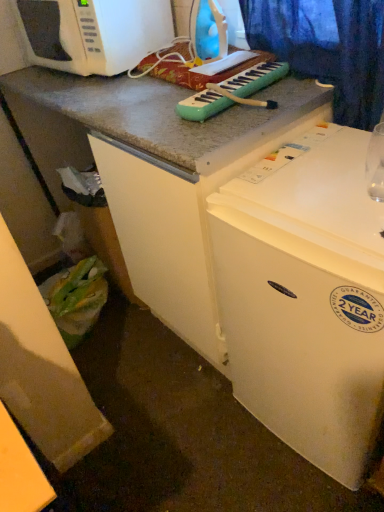
You are a GUI agent. You are given a task and a screenshot of the screen. Output one action in this format:
    pyautogui.click(x=<x>, y=<y>)
    Task: Click on the white matte refrigerator at upper right
    The height and width of the screenshot is (512, 384).
    Given the screenshot: What is the action you would take?
    pyautogui.click(x=306, y=297)

In order to face smooth white countertop at lower left, should I rotate leftwards or rightwards?

Rotate your view left by about 22.094°.

Where is `transparent glass at upper right`? The image size is (384, 512). transparent glass at upper right is located at coordinates [x=375, y=164].

Describe the element at coordinates (233, 92) in the screenshot. I see `teal plastic musical keyboard at center` at that location.

This screenshot has width=384, height=512. I want to click on teal plastic musical keyboard at center, so click(x=233, y=92).

Where is `white matte refrigerator at upper right`? white matte refrigerator at upper right is located at coordinates (306, 297).

Consider the image. Is white matte microwave oven at upper left facing towards teal plastic musical keyboard at center?

No, white matte microwave oven at upper left is not facing towards teal plastic musical keyboard at center.

Based on the photo, which object is more forward, white matte microwave oven at upper left or teal plastic musical keyboard at center?

teal plastic musical keyboard at center is in front.

From the image's perspective, is white matte microwave oven at upper left positioned above or below teal plastic musical keyboard at center?

white matte microwave oven at upper left is situated higher than teal plastic musical keyboard at center in the image.

From a real-world perspective, between white matte microwave oven at upper left and teal plastic musical keyboard at center, who is vertically higher?

In real-world perspective, white matte microwave oven at upper left is above.

Considering the positions of objects transparent glass at upper right and white matte microwave oven at upper left in the image provided, who is behind, transparent glass at upper right or white matte microwave oven at upper left?

white matte microwave oven at upper left is more distant.

From the image's perspective, is transparent glass at upper right positioned above or below white matte microwave oven at upper left?

Clearly, from the image's perspective, transparent glass at upper right is below white matte microwave oven at upper left.

From the picture: What's the angular difference between transparent glass at upper right and white matte microwave oven at upper left's facing directions?

The facing directions of transparent glass at upper right and white matte microwave oven at upper left are 17.1 degrees apart.

Considering the sizes of objects transparent glass at upper right and white matte microwave oven at upper left in the image provided, who is shorter, transparent glass at upper right or white matte microwave oven at upper left?

With less height is transparent glass at upper right.

From the image's perspective, is smooth white countertop at lower left located above or below teal plastic musical keyboard at center?

From the image's perspective, smooth white countertop at lower left appears below teal plastic musical keyboard at center.

Can you tell me how much smooth white countertop at lower left and teal plastic musical keyboard at center differ in facing direction?

85.1 degrees.

Is smooth white countertop at lower left situated inside teal plastic musical keyboard at center or outside?

smooth white countertop at lower left is not enclosed by teal plastic musical keyboard at center.

Considering the sizes of smooth white countertop at lower left and teal plastic musical keyboard at center in the image, is smooth white countertop at lower left bigger or smaller than teal plastic musical keyboard at center?

smooth white countertop at lower left is bigger than teal plastic musical keyboard at center.

Is white matte microwave oven at upper left oriented towards transparent glass at upper right?

No, white matte microwave oven at upper left does not turn towards transparent glass at upper right.

Considering the sizes of objects white matte microwave oven at upper left and transparent glass at upper right in the image provided, who is bigger, white matte microwave oven at upper left or transparent glass at upper right?

white matte microwave oven at upper left.

Considering the relative positions of white matte microwave oven at upper left and transparent glass at upper right in the image provided, is white matte microwave oven at upper left to the left or to the right of transparent glass at upper right?

white matte microwave oven at upper left is to the left of transparent glass at upper right.

From the image's perspective, between white matte microwave oven at upper left and transparent glass at upper right, which one is located above?

From the image's view, white matte microwave oven at upper left is above.

Does smooth white countertop at lower left appear on the left side of transparent glass at upper right?

Yes.

Does smooth white countertop at lower left touch transparent glass at upper right?

No, smooth white countertop at lower left is not in contact with transparent glass at upper right.

In order to click on counter top below the transparent glass at upper right (from a real-world perspective) in this screenshot , I will do `click(20, 472)`.

Is smooth white countertop at lower left oriented towards transparent glass at upper right?

No, smooth white countertop at lower left is not aimed at transparent glass at upper right.

Is white matte microwave oven at upper left at the back of smooth white countertop at lower left?

No, white matte microwave oven at upper left is not at the back of smooth white countertop at lower left.

Considering the sizes of objects smooth white countertop at lower left and white matte microwave oven at upper left in the image provided, who is shorter, smooth white countertop at lower left or white matte microwave oven at upper left?

With less height is white matte microwave oven at upper left.

Could white matte microwave oven at upper left be considered to be inside smooth white countertop at lower left?

No, smooth white countertop at lower left does not contain white matte microwave oven at upper left.

In the scene shown: Considering their positions, is smooth white countertop at lower left located in front of or behind white matte microwave oven at upper left?

Clearly, smooth white countertop at lower left is in front of white matte microwave oven at upper left.

From the image's perspective, is teal plastic musical keyboard at center on top of transparent glass at upper right?

Yes, from the image's perspective, teal plastic musical keyboard at center is on top of transparent glass at upper right.

From a real-world perspective, which object stands above the other?

In real-world perspective, teal plastic musical keyboard at center is above.

Would you consider teal plastic musical keyboard at center to be distant from transparent glass at upper right?

No, teal plastic musical keyboard at center is not far away from transparent glass at upper right.

Is teal plastic musical keyboard at center facing towards transparent glass at upper right?

No, teal plastic musical keyboard at center does not turn towards transparent glass at upper right.

At what (x,y) coordinates should I click in order to perform the action: click on microwave oven above the teal plastic musical keyboard at center (from a real-world perspective). Please return your answer as a coordinate pair (x, y). Looking at the image, I should click on (93, 33).

The height and width of the screenshot is (512, 384). Find the location of `microwave oven behind the transparent glass at upper right`. microwave oven behind the transparent glass at upper right is located at coordinates (93, 33).

Which object lies further to the anchor point white matte microwave oven at upper left, white matte refrigerator at upper right or smooth white countertop at lower left?

smooth white countertop at lower left is positioned further to the anchor white matte microwave oven at upper left.

Estimate the real-world distances between objects in this image. Which object is closer to transparent glass at upper right, teal plastic musical keyboard at center or smooth white countertop at lower left?

teal plastic musical keyboard at center is positioned closer to the anchor transparent glass at upper right.

When comparing their distances from teal plastic musical keyboard at center, does white matte refrigerator at upper right or white matte microwave oven at upper left seem further?

Among the two, white matte microwave oven at upper left is located further to teal plastic musical keyboard at center.

Looking at this image, considering their positions, is teal plastic musical keyboard at center positioned closer to smooth white countertop at lower left than white matte microwave oven at upper left?

teal plastic musical keyboard at center.

Looking at the image, which one is located further to smooth white countertop at lower left, transparent glass at upper right or teal plastic musical keyboard at center?

The object further to smooth white countertop at lower left is teal plastic musical keyboard at center.

When comparing their distances from white matte microwave oven at upper left, does smooth white countertop at lower left or teal plastic musical keyboard at center seem closer?

Based on the image, teal plastic musical keyboard at center appears to be nearer to white matte microwave oven at upper left.

Consider the image. Considering their positions, is white matte microwave oven at upper left positioned further to white matte refrigerator at upper right than teal plastic musical keyboard at center?

white matte microwave oven at upper left.

Considering their positions, is teal plastic musical keyboard at center positioned closer to smooth white countertop at lower left than transparent glass at upper right?

transparent glass at upper right is positioned closer to the anchor smooth white countertop at lower left.

Identify the location of musical keyboard between white matte microwave oven at upper left and white matte refrigerator at upper right vertically. (233, 92).

This screenshot has width=384, height=512. Identify the location of refrigerator between white matte microwave oven at upper left and smooth white countertop at lower left vertically. (306, 297).

This screenshot has height=512, width=384. Identify the location of coffee cup between teal plastic musical keyboard at center and white matte refrigerator at upper right in the up-down direction. (375, 164).

This screenshot has width=384, height=512. Find the location of `musical keyboard between white matte microwave oven at upper left and transparent glass at upper right`. musical keyboard between white matte microwave oven at upper left and transparent glass at upper right is located at coordinates (233, 92).